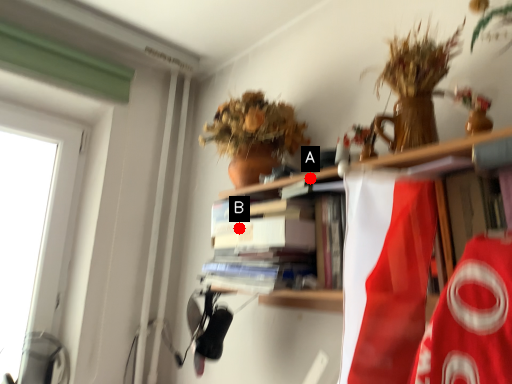
Question: Two points are circled on the image, labeled by A and B beside each circle. Which point appears farthest from the camera in this image?

Choices:
 (A) A is further
 (B) B is further

Answer: (B)